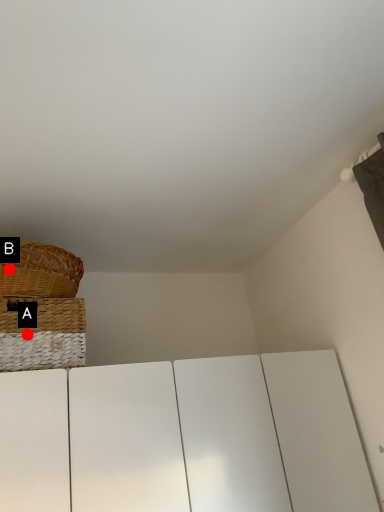
Question: Two points are circled on the image, labeled by A and B beside each circle. Which of the following is the closest to the observer?

Choices:
 (A) A is closer
 (B) B is closer

Answer: (A)